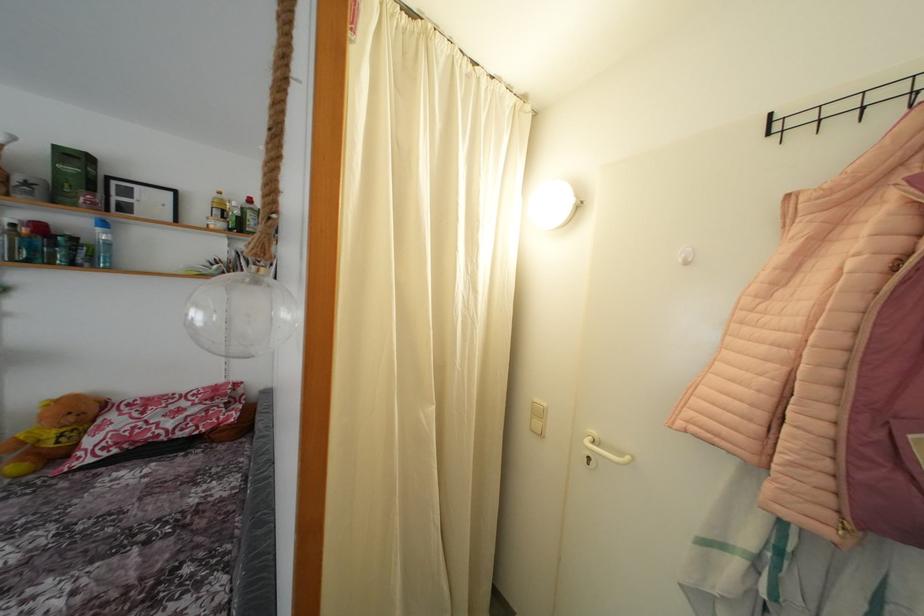
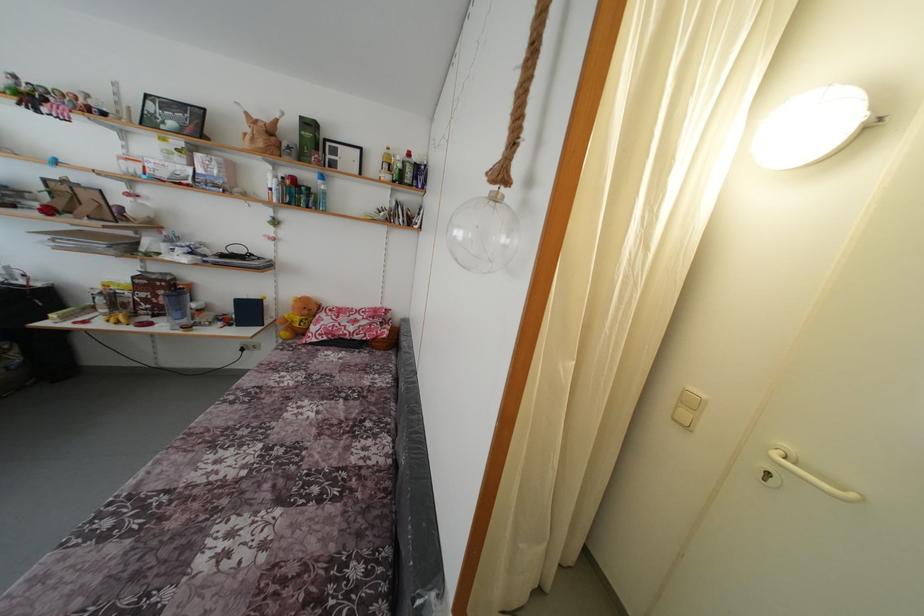
Locate, in the second image, the point that corresponds to point (541, 406) in the first image.

(696, 394)